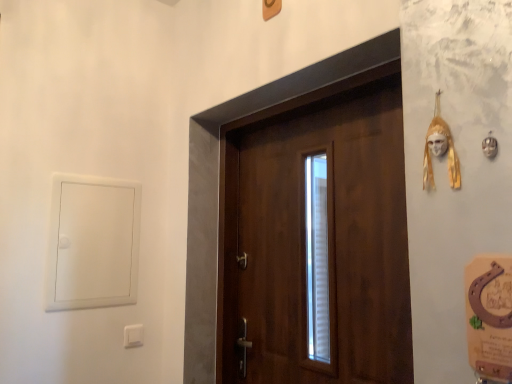
Question: From their relative heights in the image, would you say white plastic window at left is taller or shorter than gold textured mask at upper right?

Choices:
 (A) short
 (B) tall

Answer: (B)

Question: Is point (100, 253) closer or farther from the camera than point (455, 153)?

Choices:
 (A) farther
 (B) closer

Answer: (A)

Question: Estimate the real-world distances between objects in this image. Which object is farther from the white plastic light switch at lower left?

Choices:
 (A) wooden door at center
 (B) white plastic window at left
 (C) gold textured mask at upper right

Answer: (C)

Question: Which of these objects is positioned farthest from the white plastic window at left?

Choices:
 (A) gold textured mask at upper right
 (B) white plastic light switch at lower left
 (C) wooden door at center

Answer: (A)